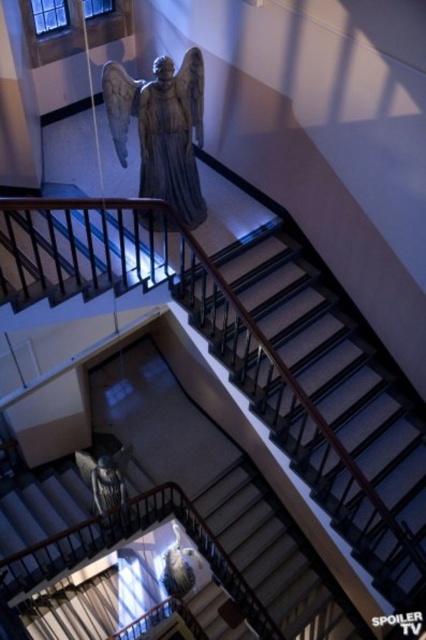
Question: Is smooth gray stairs at center thinner than matte gray statue at center?

Choices:
 (A) yes
 (B) no

Answer: (B)

Question: Among these points, which one is nearest to the camera?

Choices:
 (A) (259, 268)
 (B) (163, 244)

Answer: (B)

Question: Which object is positioned closest to the black metal balustrade at upper center?

Choices:
 (A) matte gray statue at center
 (B) smooth gray stairs at center

Answer: (A)

Question: Is matte gray statue at center thinner than white marble pillar at upper left?

Choices:
 (A) yes
 (B) no

Answer: (B)

Question: Estimate the real-world distances between objects in this image. Which object is farther from the black metal balustrade at upper center?

Choices:
 (A) white marble pillar at upper left
 (B) matte gray statue at center
 (C) smooth gray stairs at center

Answer: (A)

Question: Can you confirm if smooth gray stairs at center is positioned below black metal balustrade at upper center?

Choices:
 (A) yes
 (B) no

Answer: (A)